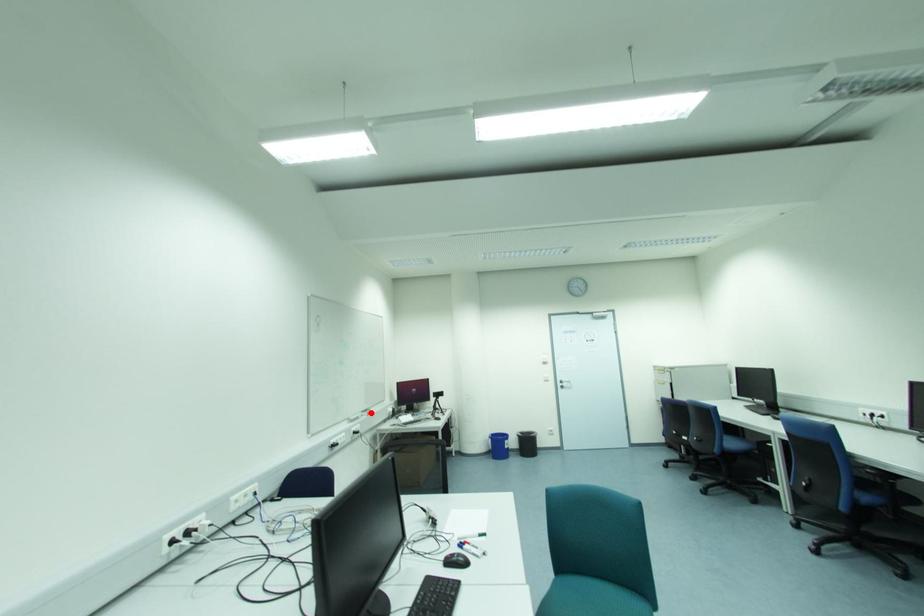
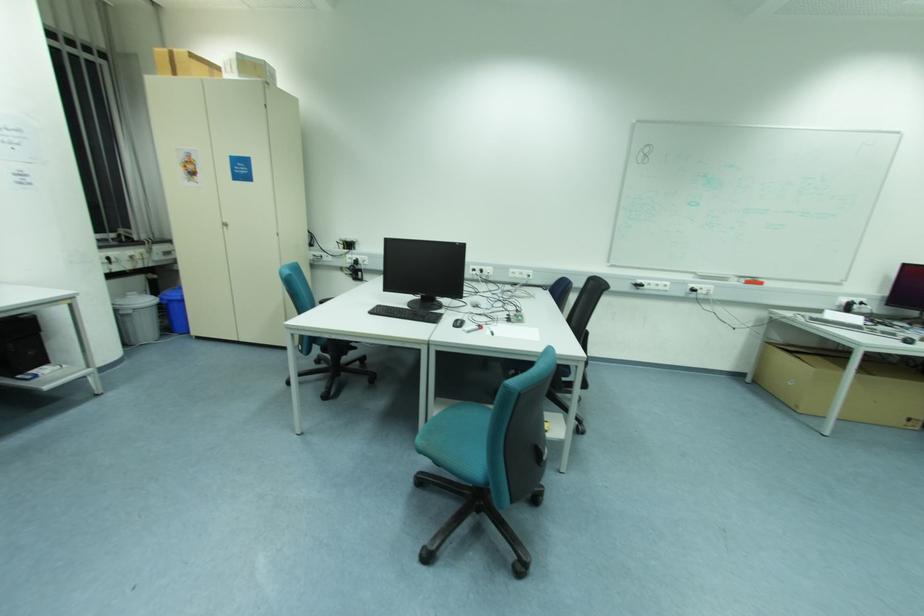
Find the pixel in the second image that matches the highlighted location in the first image.

(761, 284)